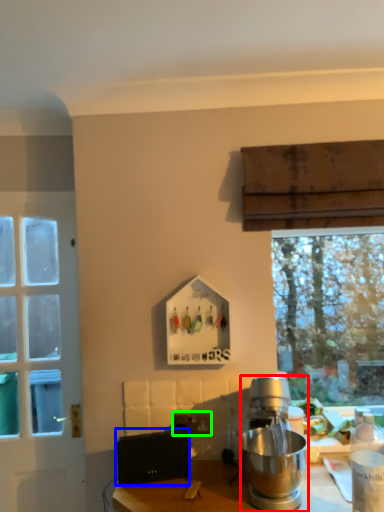
Question: Which object is positioned farthest from kitchen appliance (highlighted by a red box)? Select from appliance (highlighted by a blue box) and power outlet (highlighted by a green box).

Choices:
 (A) appliance
 (B) power outlet

Answer: (A)